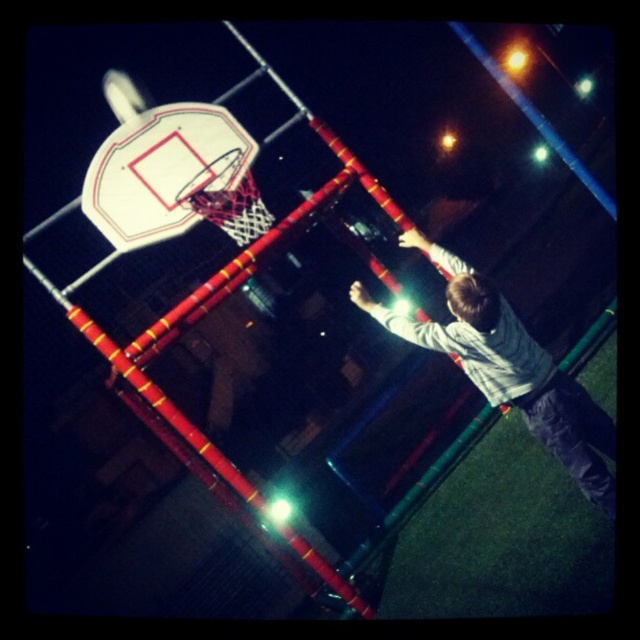
You are standing at the point marked by the coordinates point (509, 369). Looking around, you see a basketball hoop mounted on a red metal frame and a person in a light gray sweater at center. Which object is closer to you?

The point (509, 369) marks the light gray sweater at center, so you are standing at the location of the light gray sweater at center. Therefore, the light gray sweater at center is right where you are standing, making it the closest object to you.

You are a basketball player trying to shoot a ball into the hoop. You notice the light gray sweater at center and the white glossy basketball hoop at upper center. Which object is taller in the image?

The light gray sweater at center is taller than the white glossy basketball hoop at upper center.

You are standing at the center of the basketball court and see two points marked in the image. Which point, point (488, 385) or point (230, 180), is closer to you?

Point (488, 385) is closer to the viewer than point (230, 180).